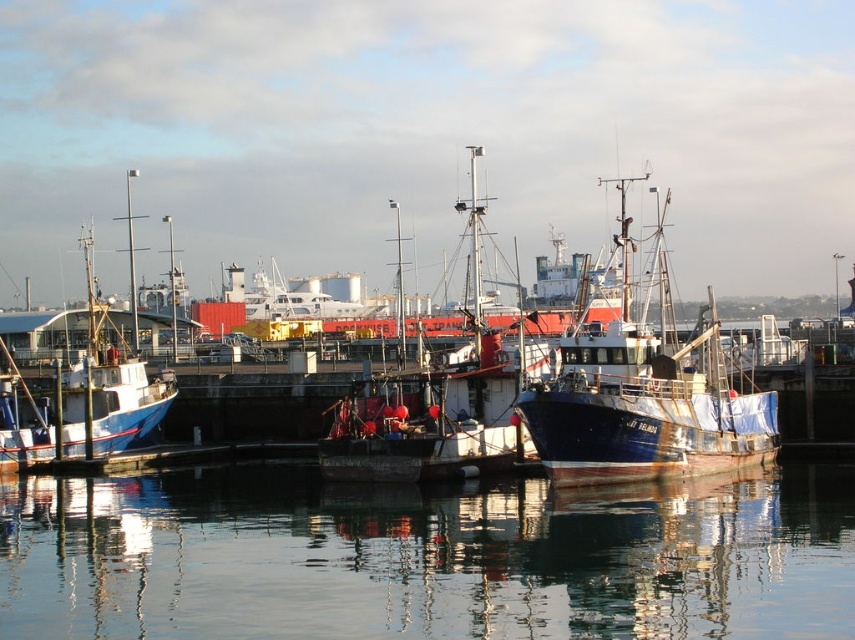
Question: Can you confirm if transparent water at center is positioned to the left of wooden boat at center?

Choices:
 (A) yes
 (B) no

Answer: (B)

Question: Considering the real-world distances, which object is farthest from the blue painted wooden boat at left?

Choices:
 (A) blue matte fishing boat at center
 (B) wooden boat at center

Answer: (A)

Question: Which point appears closest to the camera in this image?

Choices:
 (A) (358, 436)
 (B) (102, 316)

Answer: (A)

Question: Does transparent water at center have a greater width compared to blue painted wooden boat at left?

Choices:
 (A) no
 (B) yes

Answer: (A)

Question: Can you confirm if transparent water at center is positioned below blue matte fishing boat at center?

Choices:
 (A) no
 (B) yes

Answer: (B)

Question: Which of the following is the closest to the observer?

Choices:
 (A) wooden boat at center
 (B) transparent water at center
 (C) blue matte fishing boat at center
 (D) blue painted wooden boat at left

Answer: (B)